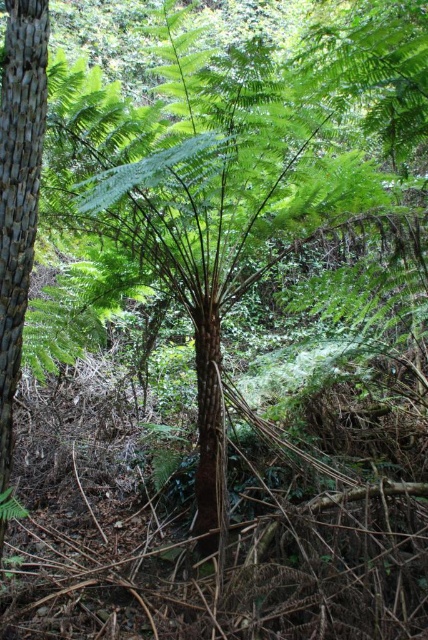
Question: Which of the following is the closest to the observer?

Choices:
 (A) (35, 38)
 (B) (202, 483)

Answer: (A)

Question: Which of the following is the closest to the observer?

Choices:
 (A) 220,420
 (B) 14,307

Answer: (B)

Question: Does wooden textured pole at left have a lesser width compared to brown rough tree trunk at center?

Choices:
 (A) no
 (B) yes

Answer: (A)

Question: In this image, where is wooden textured pole at left located relative to brown rough tree trunk at center?

Choices:
 (A) left
 (B) right

Answer: (A)

Question: Does wooden textured pole at left come in front of brown rough tree trunk at center?

Choices:
 (A) yes
 (B) no

Answer: (A)